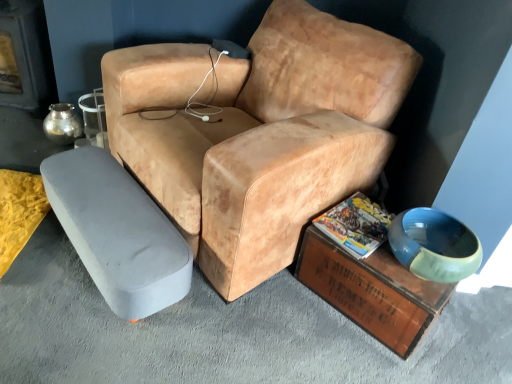
Find the location of a particular element. Image resolution: width=512 pixels, height=384 pixels. vacant area that is in front of wooden crate at lower right, placed as the first table when sorted from right to left is located at coordinates (355, 358).